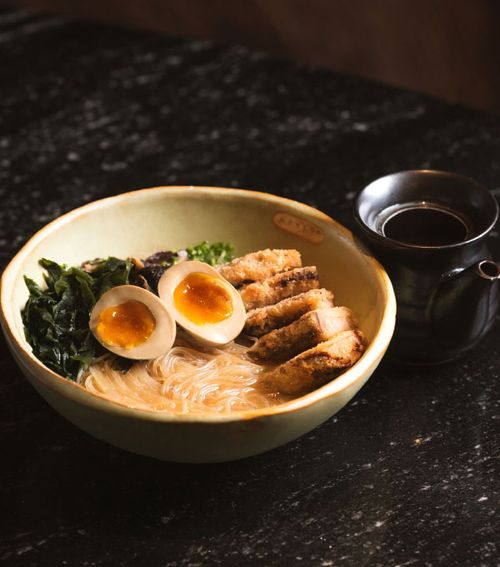
Where is `left corner`? left corner is located at coordinates (0, 2).